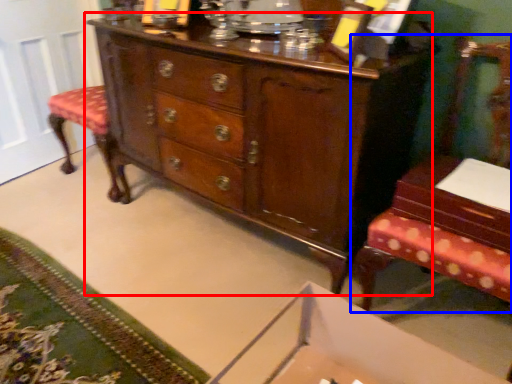
Question: Among these objects, which one is farthest to the camera, chest of drawers (highlighted by a red box) or furniture (highlighted by a blue box)?

Choices:
 (A) chest of drawers
 (B) furniture

Answer: (A)